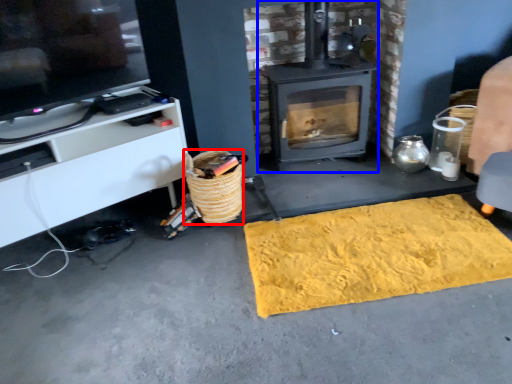
Question: Which object is further to the camera taking this photo, basket (highlighted by a red box) or wood burning stove (highlighted by a blue box)?

Choices:
 (A) basket
 (B) wood burning stove

Answer: (B)